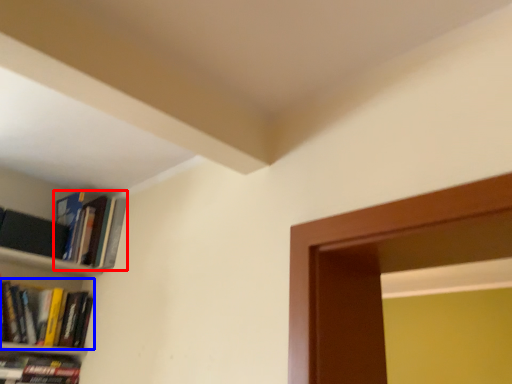
Question: Which of the following is the farthest to the observer, book (highlighted by a red box) or book (highlighted by a blue box)?

Choices:
 (A) book
 (B) book

Answer: (A)